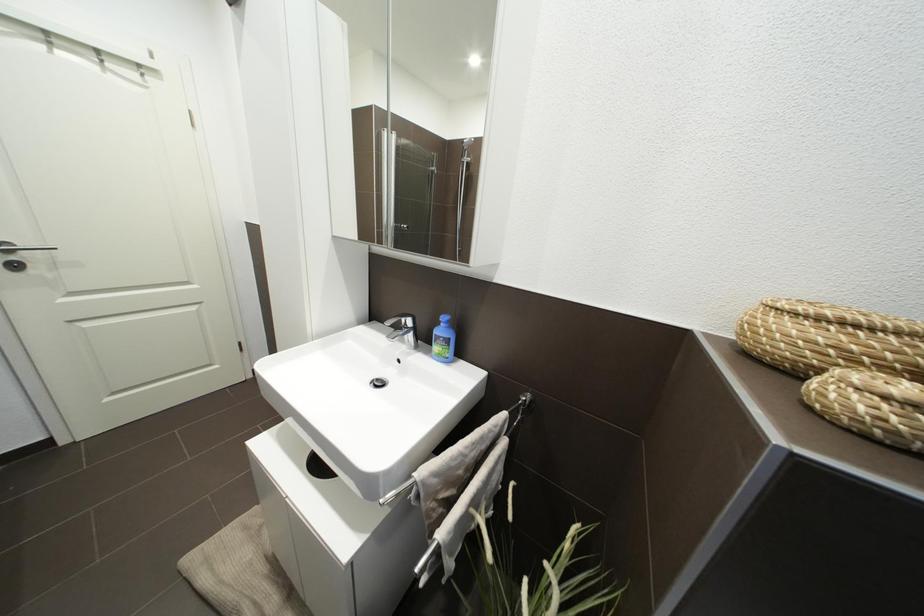
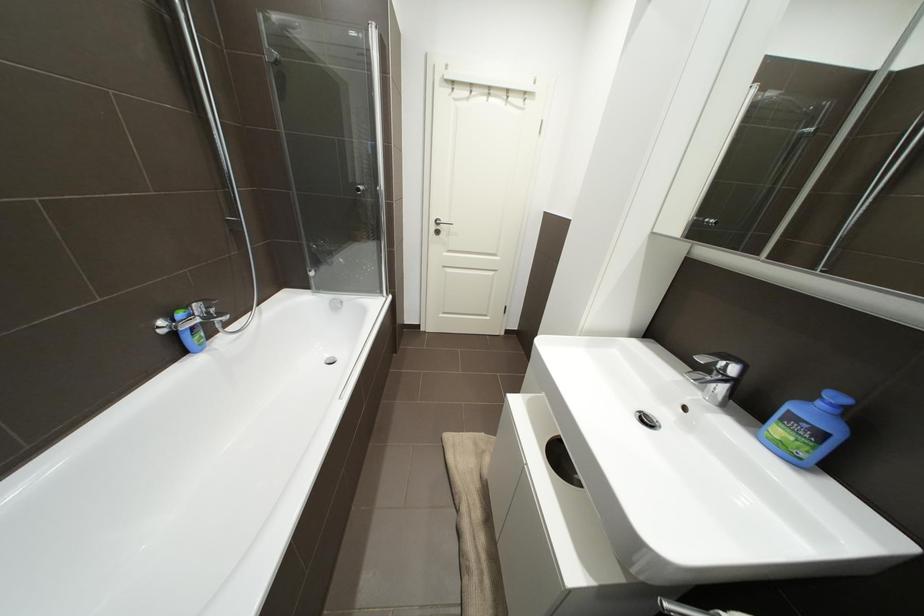
Question: The camera is either moving clockwise (left) or counter-clockwise (right) around the object. The first image is from the beginning of the video and the second image is from the end. Is the camera moving left or right when shooting the video?

Choices:
 (A) Left
 (B) Right

Answer: (B)